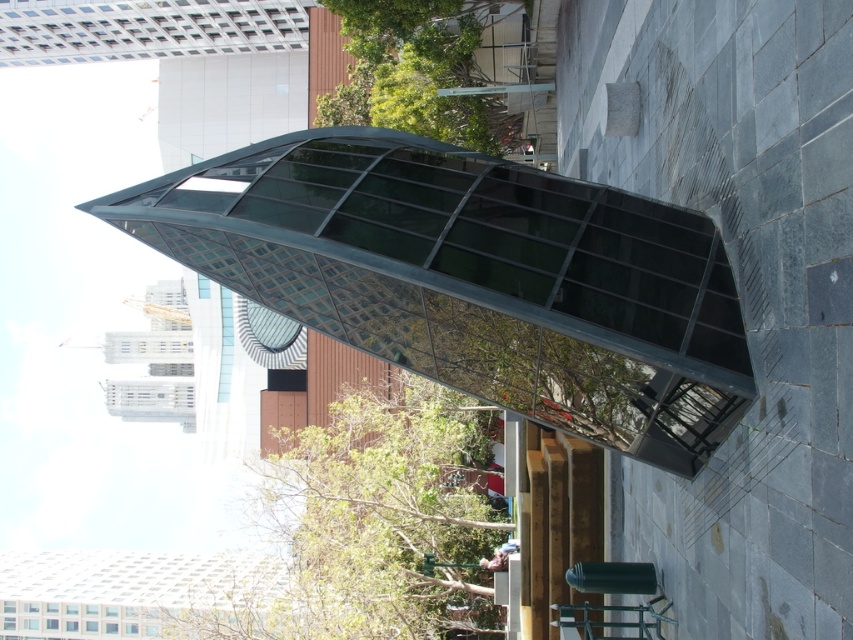
Based on the photo, you are a visitor to the city and want to take a photo of the transparent glass canopy at center while sitting on the metallic silver chair at lower center. Can you fit both the entire canopy and the chair in your camera frame if your camera can only capture objects within a 1.5 meter width?

The transparent glass canopy at center is bigger than the metallic silver chair at lower center. Since the camera can only capture objects within a 1.5 meter width, you need to check the actual size of the canopy. If the canopy is wider than 1.5 meters, it won

You are standing in front of the modern architectural structure and want to sit down. You see the transparent glass canopy at center and the metallic silver chair at lower center. Which object is closer to you?

The transparent glass canopy at center is closer to you because it is in front of the metallic silver chair at lower center.

You are standing at the point marked as point [473,276] in the image. Describe what you see directly above you.

The transparent glass canopy at center is directly above you.